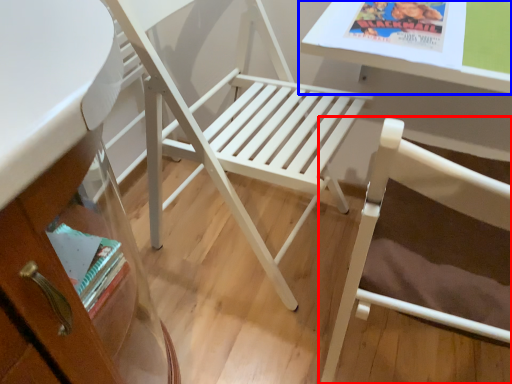
Question: Which object appears closest to the camera in this image, chair (highlighted by a red box) or table (highlighted by a blue box)?

Choices:
 (A) chair
 (B) table

Answer: (A)